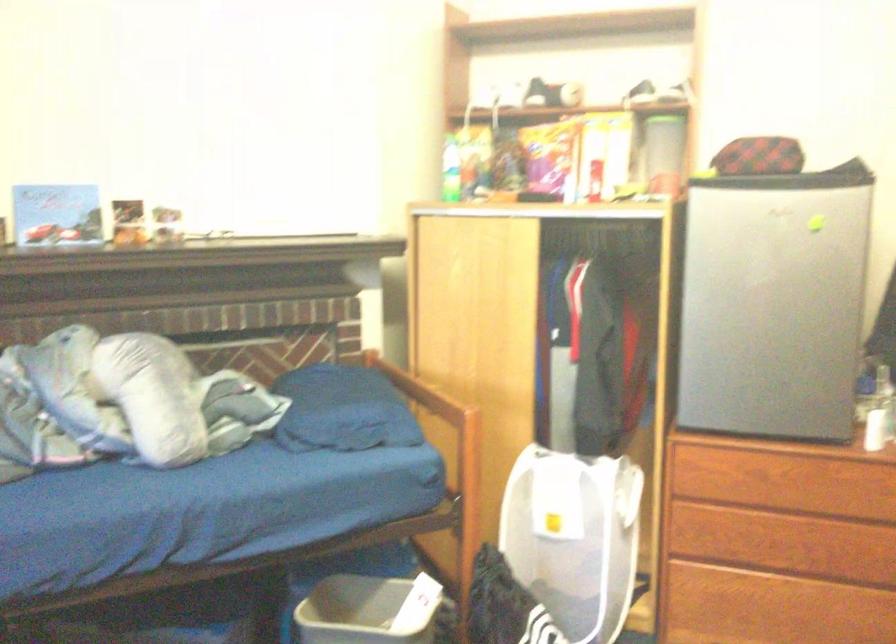
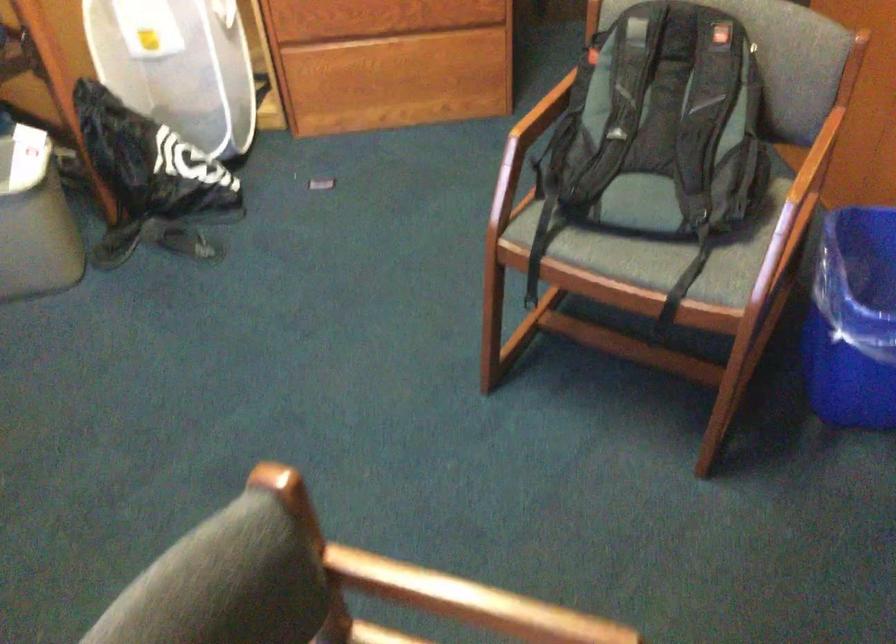
First-person continuous shooting, in which direction is the camera rotating?

The camera's rotation is toward right-down.